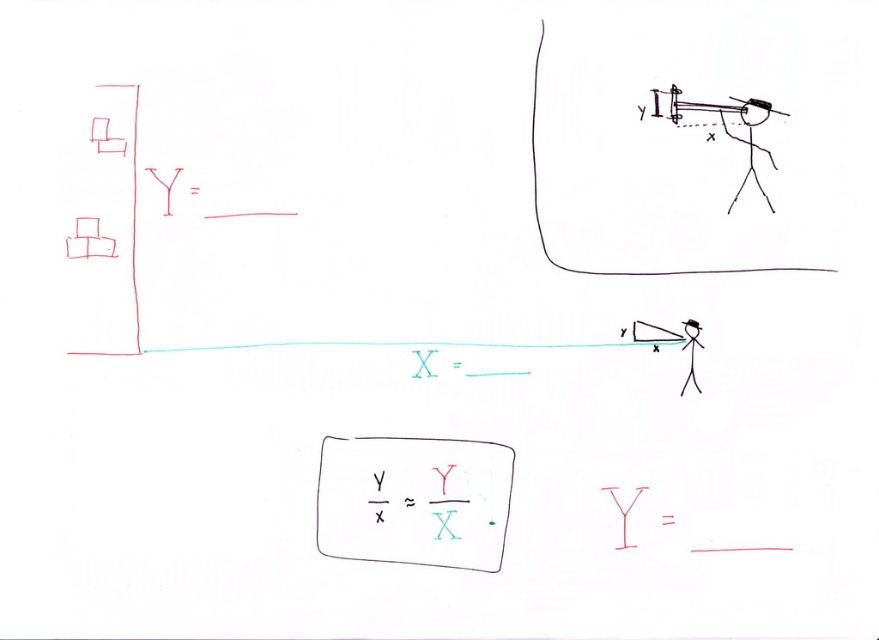
Question: Among these objects, which one is farthest from the camera?

Choices:
 (A) matte black telescope at upper right
 (B) white paper rectangle at center

Answer: (B)

Question: Which point is closer to the camera taking this photo?

Choices:
 (A) (361, 477)
 (B) (752, 122)

Answer: (B)

Question: Can you confirm if white paper rectangle at center is smaller than matte black telescope at upper right?

Choices:
 (A) yes
 (B) no

Answer: (B)

Question: Is white paper rectangle at center above matte black telescope at upper right?

Choices:
 (A) no
 (B) yes

Answer: (A)

Question: Observing the image, what is the correct spatial positioning of white paper rectangle at center in reference to matte black telescope at upper right?

Choices:
 (A) right
 (B) left

Answer: (B)

Question: Which of the following is the farthest from the observer?

Choices:
 (A) white paper rectangle at center
 (B) matte black telescope at upper right

Answer: (A)